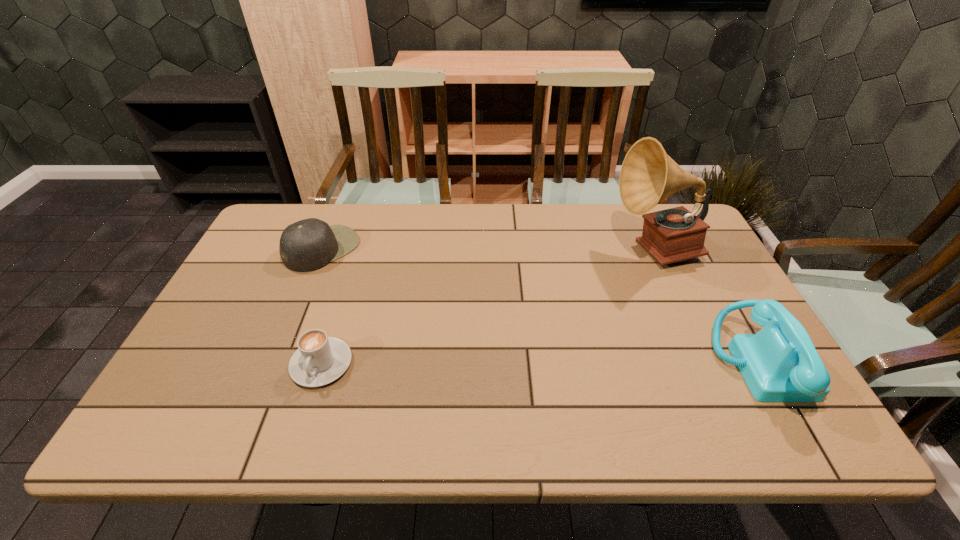
The image size is (960, 540). I want to click on cappuccino, so click(x=319, y=360).

What are the coordinates of `the second tallest object` in the screenshot? It's located at (780, 363).

Find the location of a particular element. The image size is (960, 540). phonograph record is located at coordinates (648, 175).

The width and height of the screenshot is (960, 540). I want to click on cap, so click(307, 245).

Image resolution: width=960 pixels, height=540 pixels. Find the location of `free region located on the horn of the tallest object`. free region located on the horn of the tallest object is located at coordinates (600, 288).

Where is `vacant space located on the horn of the tallest object`? The height and width of the screenshot is (540, 960). vacant space located on the horn of the tallest object is located at coordinates (580, 303).

Where is `free space located 0.330m on the horn of the tallest object`? This screenshot has width=960, height=540. free space located 0.330m on the horn of the tallest object is located at coordinates (556, 322).

Locate an element on the screen. free space located on the brim of the cap is located at coordinates (431, 326).

The height and width of the screenshot is (540, 960). Find the location of `free region located 0.290m on the brim of the cap`. free region located 0.290m on the brim of the cap is located at coordinates (410, 311).

Find the location of a particular element. free space located on the brim of the cap is located at coordinates (420, 319).